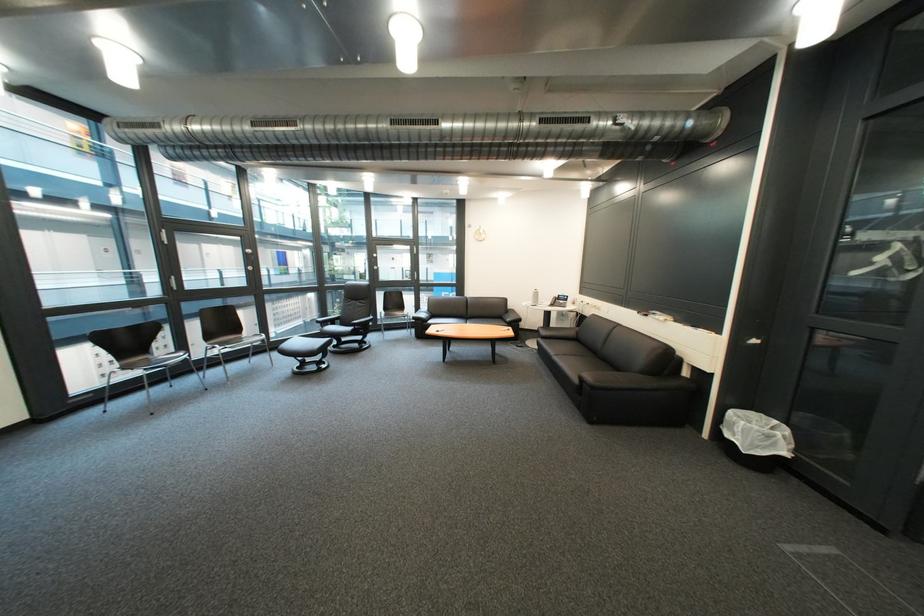
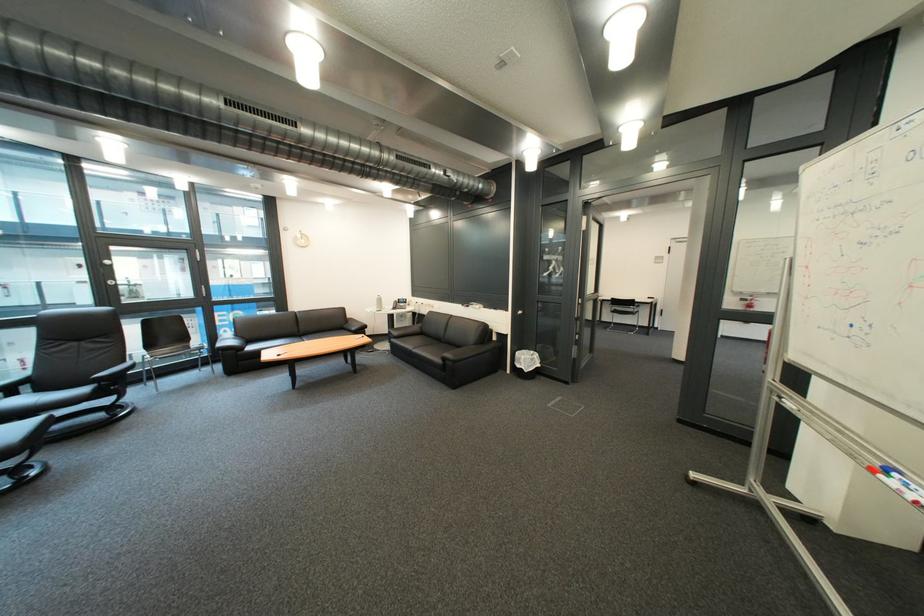
Question: Based on the continuous images, in which direction is the camera rotating? Reply with the corresponding letter.

Choices:
 (A) Left
 (B) Right
 (C) Up
 (D) Down

Answer: (B)